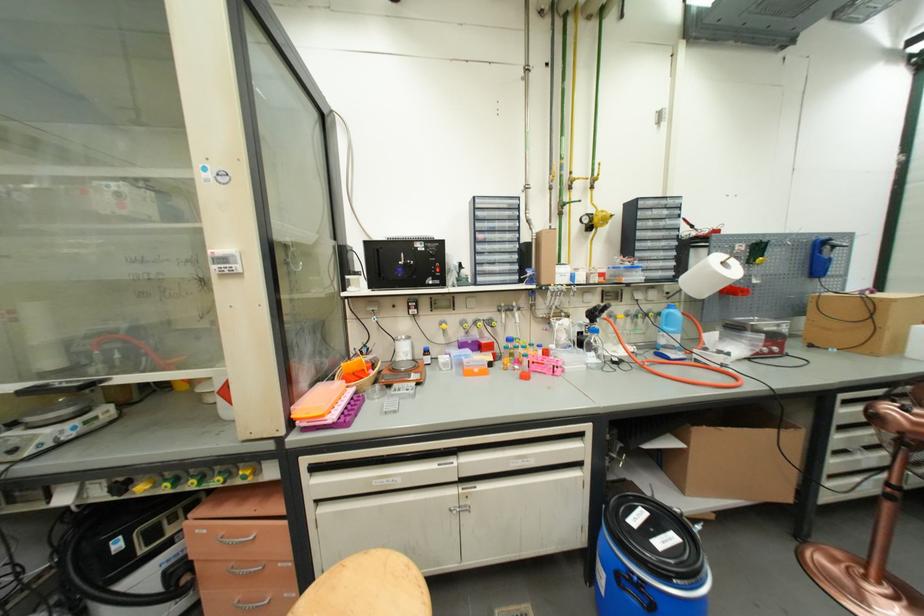
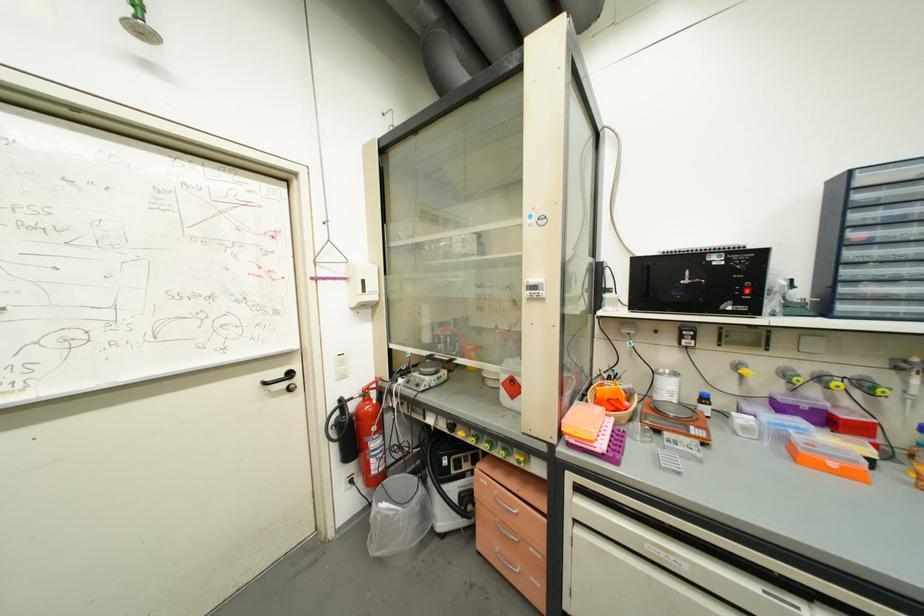
Locate, in the second image, the point that corresponds to the point at 475,344 in the first image.

(807, 410)